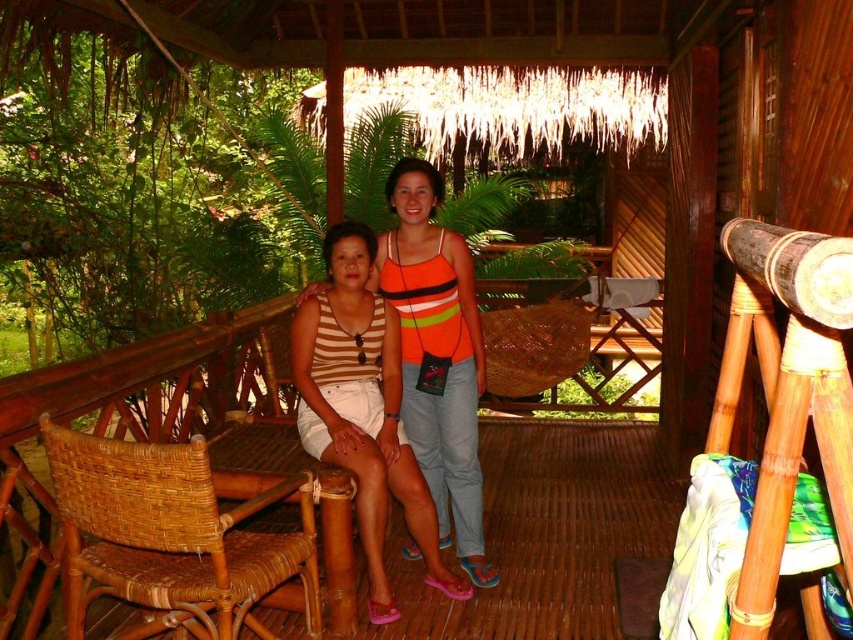
Question: Which object appears farthest from the camera in this image?

Choices:
 (A) woven rattan chair at lower left
 (B) orange striped tank top at center

Answer: (B)

Question: Among these points, which one is farthest from the camera?

Choices:
 (A) pyautogui.click(x=466, y=544)
 (B) pyautogui.click(x=231, y=534)

Answer: (A)

Question: Where is woven rattan chair at lower left located in relation to orange striped tank top at center in the image?

Choices:
 (A) above
 (B) below

Answer: (B)

Question: Can you confirm if woven rattan chair at lower left is wider than orange striped tank top at center?

Choices:
 (A) yes
 (B) no

Answer: (A)

Question: Can you confirm if woven rattan chair at lower left is positioned above orange striped tank top at center?

Choices:
 (A) yes
 (B) no

Answer: (B)